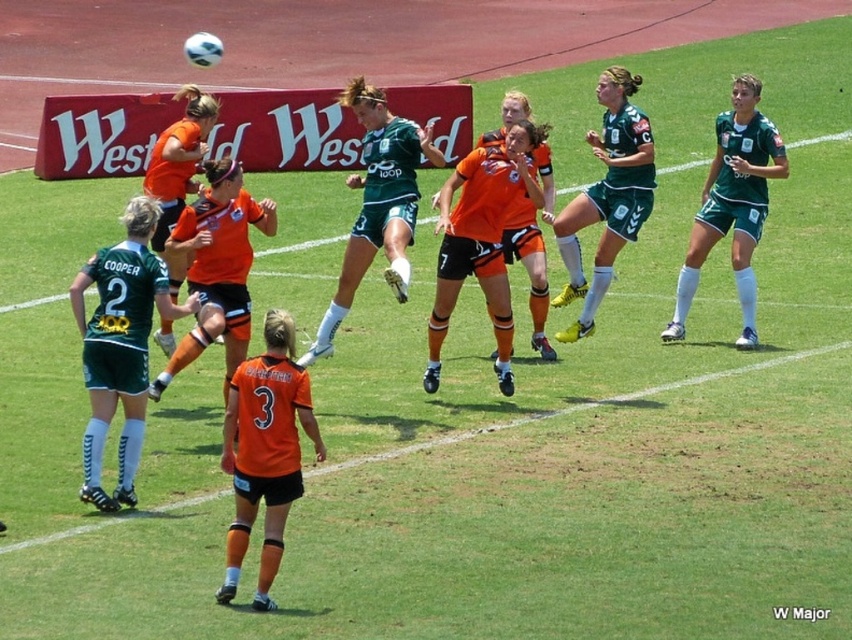
Question: Can you confirm if matte green jersey at left is positioned below green matte shorts at upper right?

Choices:
 (A) no
 (B) yes

Answer: (B)

Question: In this image, where is matte green jersey at left located relative to green jersey at center?

Choices:
 (A) below
 (B) above

Answer: (A)

Question: Does green matte shorts at upper right have a larger size compared to orange jersey at center?

Choices:
 (A) no
 (B) yes

Answer: (A)

Question: Which object appears closest to the camera in this image?

Choices:
 (A) green matte shorts at right
 (B) matte green jersey at left
 (C) orange jersey at center

Answer: (B)

Question: Which is nearer to the matte green jersey at left?

Choices:
 (A) orange jersey at center
 (B) green matte shorts at upper right

Answer: (A)

Question: Among these points, which one is nearest to the camera?

Choices:
 (A) (753, 288)
 (B) (574, 275)
 (C) (341, 288)
 (D) (87, 387)

Answer: (D)